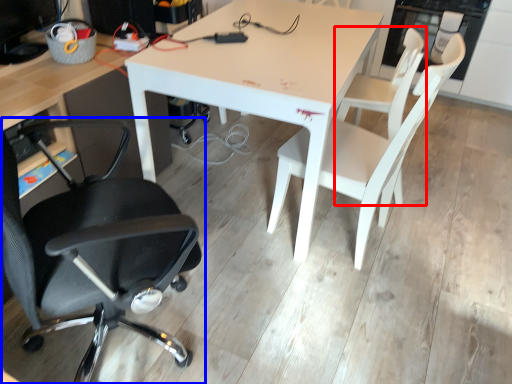
Question: Which object is closer to the camera taking this photo, chair (highlighted by a red box) or chair (highlighted by a blue box)?

Choices:
 (A) chair
 (B) chair

Answer: (B)